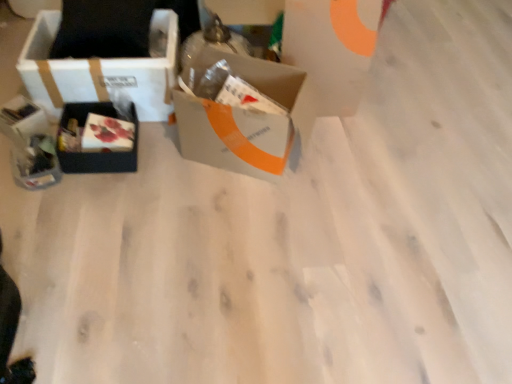
Find the location of a particular element. The height and width of the screenshot is (384, 512). matte plastic box at center-left is located at coordinates (106, 134).

This screenshot has width=512, height=384. I want to click on gray cardboard box at center, which is counted as the 3th box, starting from the left, so click(x=243, y=117).

What do you see at coordinates (333, 47) in the screenshot? This screenshot has height=384, width=512. I see `white cardboard box at upper center` at bounding box center [333, 47].

What is the approximate width of matte black box at left, the second box viewed from the left?

The width of matte black box at left, the second box viewed from the left, is 11.85 inches.

The width and height of the screenshot is (512, 384). What are the coordinates of `white cardboard box at left, the third box when ordered from right to left` in the screenshot? It's located at (101, 70).

Where is `matte plastic box at center-left`? The width and height of the screenshot is (512, 384). matte plastic box at center-left is located at coordinates (106, 134).

Is matte plastic box at center-left looking in the opposite direction of gray cardboard box at center, which is counted as the 3th box, starting from the left?

No, matte plastic box at center-left is not facing away from gray cardboard box at center, which is counted as the 3th box, starting from the left.

Is point (106, 137) closer or farther from the camera than point (260, 169)?

Point (106, 137).

The height and width of the screenshot is (384, 512). Identify the location of food that is behind the gray cardboard box at center, the first box positioned from the right. (106, 134).

Is matte black gift box at left, the second gift box viewed from the top, looking in the opposite direction of gray cardboard box at center, which is counted as the 3th box, starting from the left?

matte black gift box at left, the second gift box viewed from the top, is not turned away from gray cardboard box at center, which is counted as the 3th box, starting from the left.

Is matte black gift box at left, the second gift box viewed from the top, positioned before gray cardboard box at center, the first box positioned from the right?

No, matte black gift box at left, the second gift box viewed from the top, is further to the viewer.

Between matte black gift box at left, the second gift box viewed from the top, and gray cardboard box at center, the first box positioned from the right, which one has larger width?

With larger width is gray cardboard box at center, the first box positioned from the right.

Is matte black gift box at left, the second gift box viewed from the top, positioned beyond the bounds of gray cardboard box at center, which is counted as the 3th box, starting from the left?

Indeed, matte black gift box at left, the second gift box viewed from the top, is completely outside gray cardboard box at center, which is counted as the 3th box, starting from the left.

From the image's perspective, is matte black gift box at left, which ranks as the second gift box in bottom-to-top order, under matte plastic box at center-left?

Incorrect, from the image's perspective, matte black gift box at left, which ranks as the second gift box in bottom-to-top order, is higher than matte plastic box at center-left.

Between matte black gift box at left, which ranks as the second gift box in bottom-to-top order, and matte plastic box at center-left, which one has more height?

Standing taller between the two is matte black gift box at left, which ranks as the second gift box in bottom-to-top order.

Is matte black gift box at left, the 1th gift box from the top, spatially inside matte plastic box at center-left, or outside of it?

matte black gift box at left, the 1th gift box from the top, lies outside matte plastic box at center-left.

Measure the distance from matte black gift box at left, which ranks as the second gift box in bottom-to-top order, to matte plastic box at center-left.

Answer: They are 13.64 inches apart.

Between matte black box at left, the second box viewed from the left, and gray cardboard box at center, which is counted as the 3th box, starting from the left, which one has larger width?

With larger width is gray cardboard box at center, which is counted as the 3th box, starting from the left.

Who is smaller, matte black box at left, the second box viewed from the left, or gray cardboard box at center, which is counted as the 3th box, starting from the left?

matte black box at left, the second box viewed from the left, is smaller.

Considering the sizes of matte black box at left, the second box viewed from the left, and gray cardboard box at center, the first box positioned from the right, in the image, is matte black box at left, the second box viewed from the left, taller or shorter than gray cardboard box at center, the first box positioned from the right,?

Clearly, matte black box at left, the second box viewed from the left, is shorter compared to gray cardboard box at center, the first box positioned from the right.

From the picture: Is matte black box at left, which is counted as the second box, starting from the right, facing towards gray cardboard box at center, which is counted as the 3th box, starting from the left?

No, matte black box at left, which is counted as the second box, starting from the right, does not turn towards gray cardboard box at center, which is counted as the 3th box, starting from the left.

Does point (21, 130) come closer to viewer compared to point (303, 105)?

That is True.

Would you say gray cardboard box at center, the first box positioned from the right, is part of matte black gift box at left, which ranks as the second gift box in bottom-to-top order,'s contents?

No.

Does matte black gift box at left, which ranks as the second gift box in bottom-to-top order, come in front of gray cardboard box at center, the first box positioned from the right?

No, matte black gift box at left, which ranks as the second gift box in bottom-to-top order, is further to the viewer.

How different are the orientations of white cardboard box at left, the third box when ordered from right to left, and gray cardboard box at center, the first box positioned from the right, in degrees?

white cardboard box at left, the third box when ordered from right to left, and gray cardboard box at center, the first box positioned from the right, are facing 22.2 degrees away from each other.

Which of these two, white cardboard box at left, positioned as the first box in left-to-right order, or gray cardboard box at center, the first box positioned from the right, stands shorter?

Standing shorter between the two is white cardboard box at left, positioned as the first box in left-to-right order.

Is white cardboard box at left, positioned as the first box in left-to-right order, touching gray cardboard box at center, the first box positioned from the right?

white cardboard box at left, positioned as the first box in left-to-right order, and gray cardboard box at center, the first box positioned from the right, are not in contact.

From a real-world perspective, is white cardboard box at left, positioned as the first box in left-to-right order, above or below matte plastic box at center-left?

In terms of real-world spatial position, white cardboard box at left, positioned as the first box in left-to-right order, is above matte plastic box at center-left.

This screenshot has height=384, width=512. I want to click on food below the white cardboard box at left, the third box when ordered from right to left (from the image's perspective), so click(106, 134).

Which of these two, white cardboard box at left, the third box when ordered from right to left, or matte plastic box at center-left, is thinner?

With smaller width is matte plastic box at center-left.

Based on their sizes in the image, would you say white cardboard box at left, positioned as the first box in left-to-right order, is bigger or smaller than matte plastic box at center-left?

Considering their sizes, white cardboard box at left, positioned as the first box in left-to-right order, takes up more space than matte plastic box at center-left.

Where is `food behind the gray cardboard box at center, the first box positioned from the right`? Image resolution: width=512 pixels, height=384 pixels. food behind the gray cardboard box at center, the first box positioned from the right is located at coordinates (106, 134).

What are the coordinates of `the 2nd box above when counting from the matte black gift box at left, which ranks as the first gift box in bottom-to-top order (from the image's perspective)` in the screenshot? It's located at (243, 117).

Looking at this image, estimate the real-world distances between objects in this image. Which object is closer to white cardboard box at left, the third box when ordered from right to left, matte black box at left, the second box viewed from the left, or matte plastic box at center-left?

matte black box at left, the second box viewed from the left, is positioned closer to the anchor white cardboard box at left, the third box when ordered from right to left.

Looking at the image, which one is located closer to matte plastic box at center-left, matte black gift box at left, which ranks as the second gift box in bottom-to-top order, or matte black gift box at left, which ranks as the first gift box in bottom-to-top order?

Based on the image, matte black gift box at left, which ranks as the first gift box in bottom-to-top order, appears to be nearer to matte plastic box at center-left.

In the scene shown: Looking at the image, which one is located closer to matte black gift box at left, the second gift box viewed from the top, matte plastic box at center-left or gray cardboard box at center, the first box positioned from the right?

Among the two, matte plastic box at center-left is located nearer to matte black gift box at left, the second gift box viewed from the top.

Estimate the real-world distances between objects in this image. Which object is further from white cardboard box at left, the third box when ordered from right to left, matte black gift box at left, which ranks as the second gift box in bottom-to-top order, or matte black gift box at left, the second gift box viewed from the top?

matte black gift box at left, the second gift box viewed from the top, is further to white cardboard box at left, the third box when ordered from right to left.

Which object lies further to the anchor point matte black box at left, which is counted as the second box, starting from the right, white cardboard box at upper center or white cardboard box at left, positioned as the first box in left-to-right order?

white cardboard box at upper center is further to matte black box at left, which is counted as the second box, starting from the right.

Estimate the real-world distances between objects in this image. Which object is closer to gray cardboard box at center, which is counted as the 3th box, starting from the left, matte black box at left, the second box viewed from the left, or matte black gift box at left, the second gift box viewed from the top?

matte black box at left, the second box viewed from the left.

Based on their spatial positions, is gray cardboard box at center, which is counted as the 3th box, starting from the left, or matte black box at left, the second box viewed from the left, further from matte plastic box at center-left?

Based on the image, gray cardboard box at center, which is counted as the 3th box, starting from the left, appears to be further to matte plastic box at center-left.

Based on their spatial positions, is matte black gift box at left, the second gift box viewed from the top, or matte black box at left, the second box viewed from the left, closer to gray cardboard box at center, which is counted as the 3th box, starting from the left?

Based on the image, matte black box at left, the second box viewed from the left, appears to be nearer to gray cardboard box at center, which is counted as the 3th box, starting from the left.

In order to click on gift box that lies between white cardboard box at left, positioned as the first box in left-to-right order, and matte black gift box at left, which ranks as the first gift box in bottom-to-top order, from top to bottom in this screenshot , I will do `click(22, 121)`.

At what (x,y) coordinates should I click in order to perform the action: click on gift box situated between matte black gift box at left, the 1th gift box from the top, and matte plastic box at center-left from left to right. Please return your answer as a coordinate pair (x, y). This screenshot has width=512, height=384. Looking at the image, I should click on (36, 163).

Where is `food between matte black box at left, the second box viewed from the left, and gray cardboard box at center, the first box positioned from the right, in the horizontal direction`? The height and width of the screenshot is (384, 512). food between matte black box at left, the second box viewed from the left, and gray cardboard box at center, the first box positioned from the right, in the horizontal direction is located at coordinates (106, 134).

Where is `food between matte black gift box at left, which ranks as the second gift box in bottom-to-top order, and gray cardboard box at center, the first box positioned from the right`? food between matte black gift box at left, which ranks as the second gift box in bottom-to-top order, and gray cardboard box at center, the first box positioned from the right is located at coordinates (106, 134).